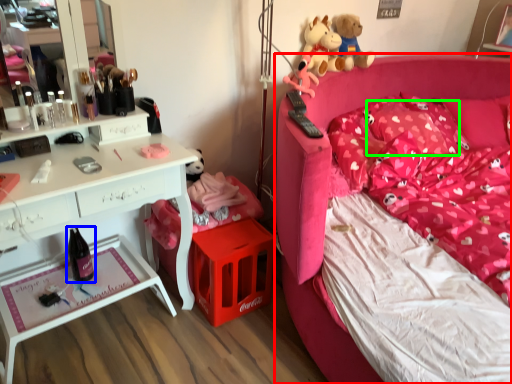
Question: Based on their relative distances, which object is nearer to bed (highlighted by a red box)? Choose from wine bottle (highlighted by a blue box) and pillow (highlighted by a green box).

Choices:
 (A) wine bottle
 (B) pillow

Answer: (B)